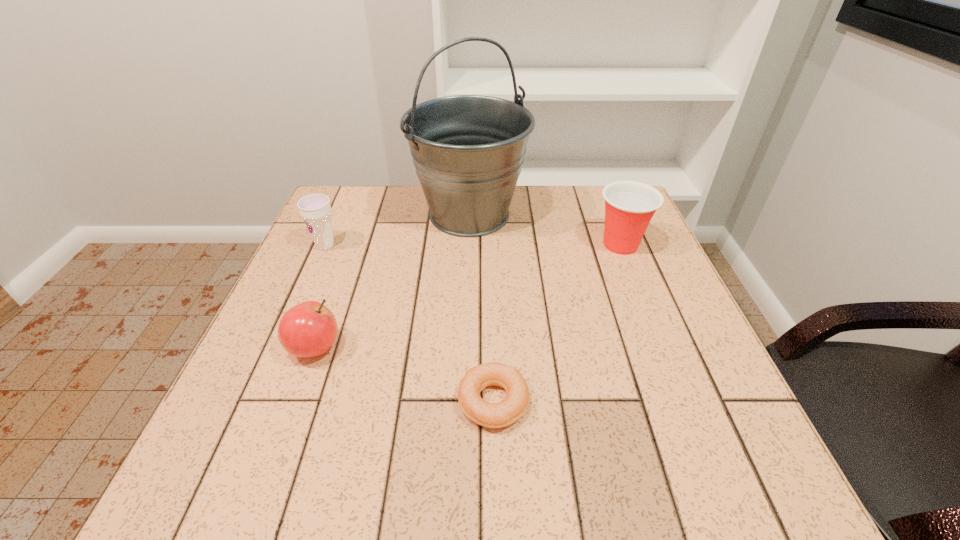
Locate an element on the screen. free space located on the front of the second nearest object is located at coordinates (279, 446).

Find the location of a particular element. The height and width of the screenshot is (540, 960). free point located on the back of the shortest object is located at coordinates (492, 343).

Identify the location of bucket positioned at the far edge. (468, 150).

Identify the location of cup that is at the far edge. (629, 206).

You are a GUI agent. You are given a task and a screenshot of the screen. Output one action in this format:
    pyautogui.click(x=<x>, y=<y>)
    Task: Click on the cup that is at the left edge
    This screenshot has width=960, height=540.
    Given the screenshot: What is the action you would take?
    pyautogui.click(x=315, y=209)

In order to click on apple that is at the left edge in this screenshot , I will do `click(309, 329)`.

At what (x,y) coordinates should I click in order to perform the action: click on object at the right edge. Please return your answer as a coordinate pair (x, y). This screenshot has height=540, width=960. Looking at the image, I should click on tap(629, 206).

I want to click on object situated at the far right corner, so click(x=629, y=206).

This screenshot has width=960, height=540. I want to click on vacant region at the far edge of the desktop, so click(413, 198).

This screenshot has width=960, height=540. In order to click on vacant space at the near edge of the desktop in this screenshot , I will do `click(552, 456)`.